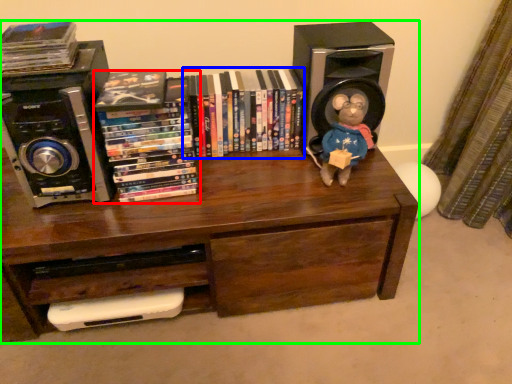
Question: Which is farther away from book (highlighted by a red box)? book (highlighted by a blue box) or bookcase (highlighted by a green box)?

Choices:
 (A) book
 (B) bookcase

Answer: (B)